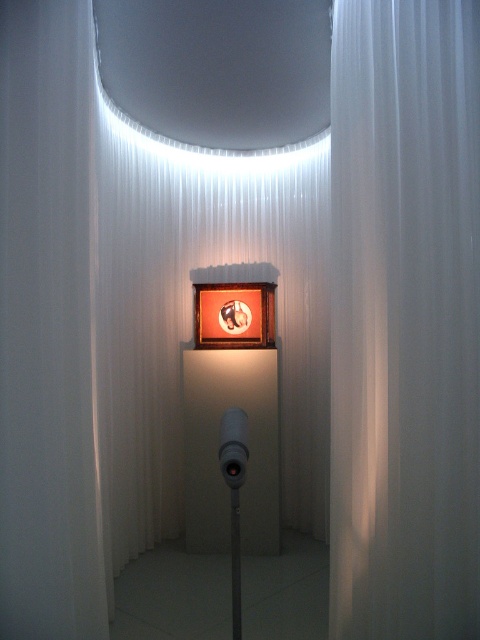
You are an interior designer planning to hang a new artwork between the white matte curtain at center and the matte white pole at center. Since the space between them is limited, which object should you place closer to the wall to ensure the artwork can fit? Please consider their sizes.

The white matte curtain at center is larger than the matte white pole at center. To fit the artwork between them, place the smaller matte white pole at center closer to the wall, leaving more space for the artwork next to the larger curtain.

You are an interior designer planning to install a new sensor between the white matte curtain at center and the matte white pole at center. The sensor requires a minimum of 60 centimeters of space to function properly. Based on the scene, will the available space between these two objects accommodate the sensor?

The distance between the white matte curtain at center and the matte white pole at center is 67.21 centimeters, which exceeds the required 60 centimeters. Therefore, the sensor can be installed between them as there is sufficient space.

You are standing in the gallery and see two points in the display case. The first point is at coordinates point (468, 468) and the second point is at point (238, 493). Which point is closer to you?

Point (468, 468) is further to the viewer than point (238, 493), so point (238, 493) is closer to you.